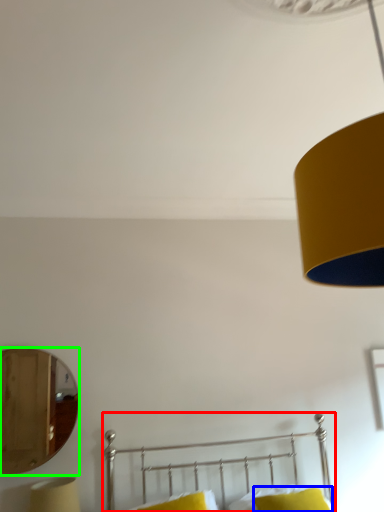
Question: Which object is positioned farthest from bed (highlighted by a red box)? Select from pillow (highlighted by a blue box) and mirror (highlighted by a green box).

Choices:
 (A) pillow
 (B) mirror

Answer: (B)